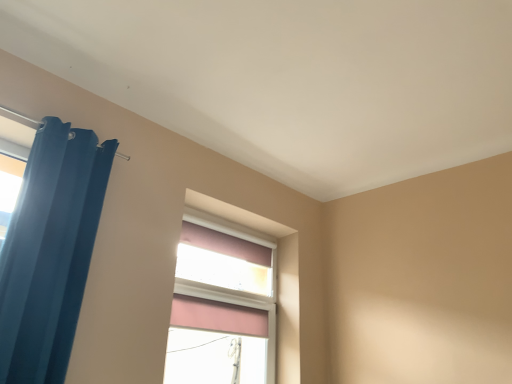
Describe the element at coordinates (222, 305) in the screenshot. I see `pink fabric window at center` at that location.

This screenshot has height=384, width=512. In order to click on pink fabric window at center in this screenshot , I will do `click(222, 305)`.

Locate an element on the screen. This screenshot has width=512, height=384. matte blue curtain at left is located at coordinates [50, 251].

This screenshot has height=384, width=512. What do you see at coordinates (50, 251) in the screenshot? I see `matte blue curtain at left` at bounding box center [50, 251].

The image size is (512, 384). In order to click on pink fabric window at center in this screenshot , I will do [x=222, y=305].

Is matte blue curtain at left at the right side of pink fabric window at center?

Incorrect, matte blue curtain at left is not on the right side of pink fabric window at center.

Is matte blue curtain at left in front of or behind pink fabric window at center in the image?

matte blue curtain at left is positioned closer to the viewer than pink fabric window at center.

Is point (55, 228) positioned after point (196, 269)?

No, it is not.

From the image's perspective, between matte blue curtain at left and pink fabric window at center, which one is located above?

matte blue curtain at left is shown above in the image.

From a real-world perspective, which object rests below the other?

pink fabric window at center.

Can you confirm if matte blue curtain at left is thinner than pink fabric window at center?

Incorrect, the width of matte blue curtain at left is not less than that of pink fabric window at center.

Who is taller, matte blue curtain at left or pink fabric window at center?

matte blue curtain at left.

Considering the relative sizes of matte blue curtain at left and pink fabric window at center in the image provided, is matte blue curtain at left bigger than pink fabric window at center?

Yes, matte blue curtain at left is bigger than pink fabric window at center.

Choose the correct answer: Is matte blue curtain at left inside pink fabric window at center or outside it?

matte blue curtain at left is not inside pink fabric window at center, it's outside.

Is matte blue curtain at left far away from pink fabric window at center?

Yes, matte blue curtain at left and pink fabric window at center are quite far apart.

Is matte blue curtain at left aimed at pink fabric window at center?

No, matte blue curtain at left is not turned towards pink fabric window at center.

The image size is (512, 384). I want to click on window below the matte blue curtain at left (from the image's perspective), so click(222, 305).

Does pink fabric window at center appear on the right side of matte blue curtain at left?

Indeed, pink fabric window at center is positioned on the right side of matte blue curtain at left.

Relative to matte blue curtain at left, is pink fabric window at center in front or behind?

In the image, pink fabric window at center appears behind matte blue curtain at left.

Is point (188, 279) farther from camera compared to point (69, 137)?

Yes, it is.

From the image's perspective, is pink fabric window at center above or below matte blue curtain at left?

From the image's perspective, pink fabric window at center appears below matte blue curtain at left.

From a real-world perspective, is pink fabric window at center under matte blue curtain at left?

Yes, from a real-world perspective, pink fabric window at center is below matte blue curtain at left.

Considering the sizes of pink fabric window at center and matte blue curtain at left in the image, is pink fabric window at center wider or thinner than matte blue curtain at left?

In the image, pink fabric window at center appears to be more narrow than matte blue curtain at left.

Can you confirm if pink fabric window at center is taller than matte blue curtain at left?

Incorrect, the height of pink fabric window at center is not larger of that of matte blue curtain at left.

Between pink fabric window at center and matte blue curtain at left, which one has larger size?

With larger size is matte blue curtain at left.

Is pink fabric window at center not inside matte blue curtain at left?

Yes, pink fabric window at center is located beyond the bounds of matte blue curtain at left.

Does pink fabric window at center touch matte blue curtain at left?

No, pink fabric window at center is not beside matte blue curtain at left.

Is pink fabric window at center aimed at matte blue curtain at left?

No, pink fabric window at center is not facing towards matte blue curtain at left.

Locate an element on the screen. curtain that appears above the pink fabric window at center (from a real-world perspective) is located at coordinates (50, 251).

Where is `window directly beneath the matte blue curtain at left (from a real-world perspective)`? This screenshot has height=384, width=512. window directly beneath the matte blue curtain at left (from a real-world perspective) is located at coordinates (222, 305).

The image size is (512, 384). I want to click on window that is on the right side of matte blue curtain at left, so click(x=222, y=305).